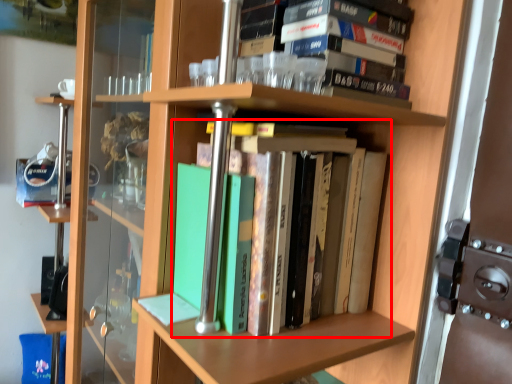
Question: From the image's perspective, where is book (annotated by the red box) located relative to book?

Choices:
 (A) below
 (B) above

Answer: (A)